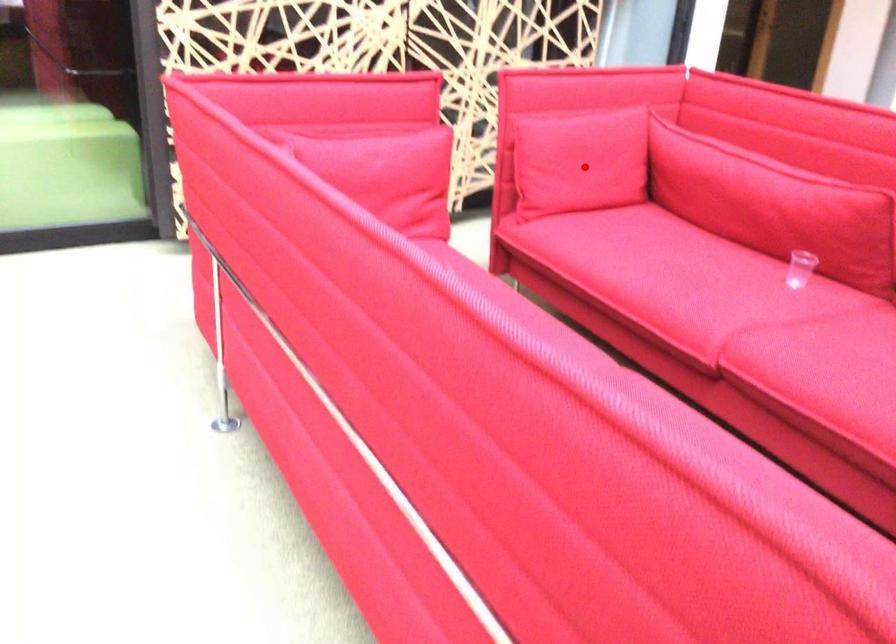
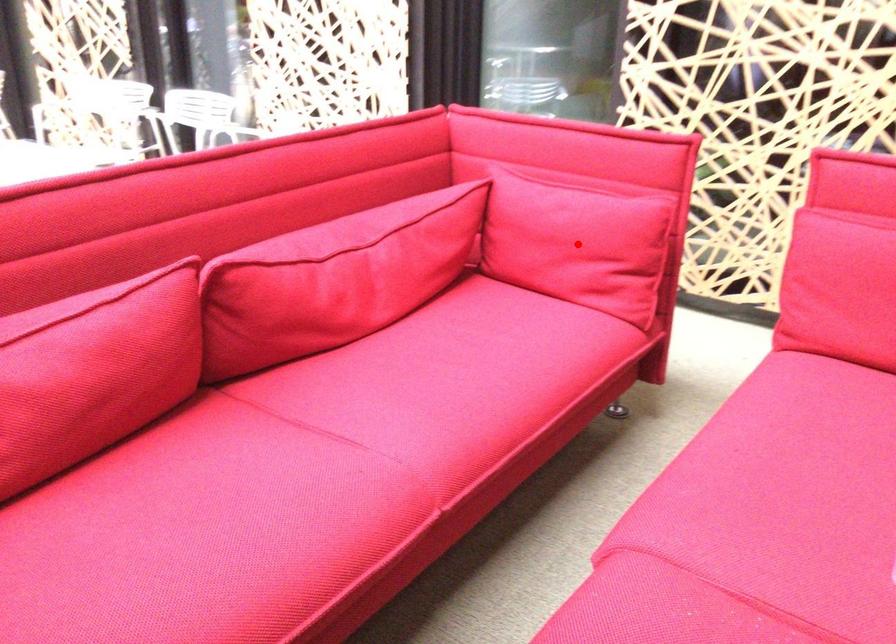
I am providing you with two images of the same scene from different viewpoints. A red point is marked on the first image and another point is marked on the second image. Do the highlighted points in image1 and image2 indicate the same real-world spot?

No